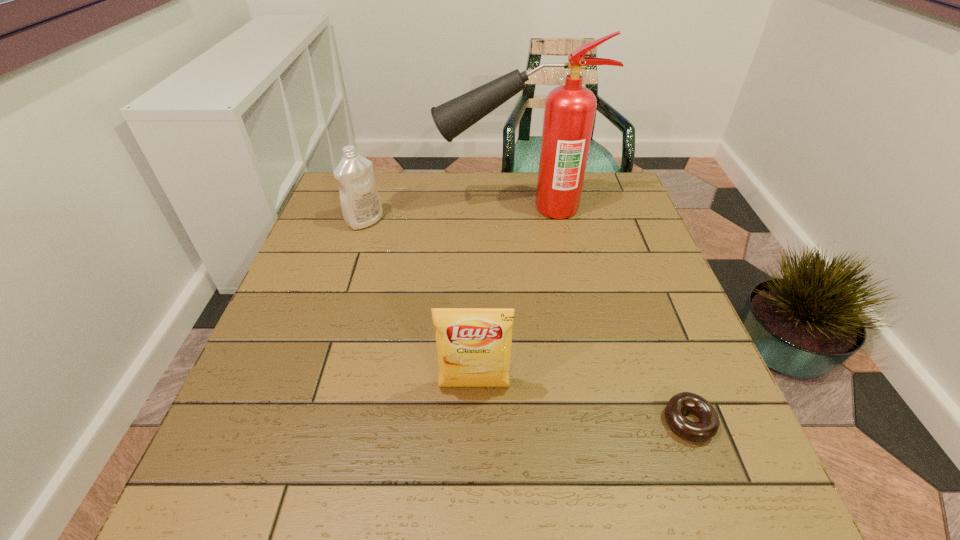
The image size is (960, 540). What are the coordinates of `vacant space situated on the left of the nearest object` in the screenshot? It's located at (540, 422).

This screenshot has height=540, width=960. Find the location of `fire extinguisher present at the far edge`. fire extinguisher present at the far edge is located at coordinates (570, 109).

Find the location of a particular element. detergent situated at the far edge is located at coordinates (361, 206).

The image size is (960, 540). Identify the location of object located in the left edge section of the desktop. (361, 206).

The image size is (960, 540). In order to click on fire extinguisher that is at the right edge in this screenshot , I will do `click(570, 109)`.

Locate an element on the screen. The image size is (960, 540). doughnut that is at the right edge is located at coordinates (708, 425).

You are a GUI agent. You are given a task and a screenshot of the screen. Output one action in this format:
    pyautogui.click(x=<x>, y=<y>)
    Task: Click on the object that is at the far left corner
    This screenshot has height=540, width=960.
    Given the screenshot: What is the action you would take?
    pyautogui.click(x=361, y=206)

I want to click on object present at the far right corner, so click(570, 109).

In the image, there is a desktop. Where is `free space at the far edge`? free space at the far edge is located at coordinates (x=424, y=204).

In the image, there is a desktop. What are the coordinates of `vacant space at the left edge` in the screenshot? It's located at (302, 264).